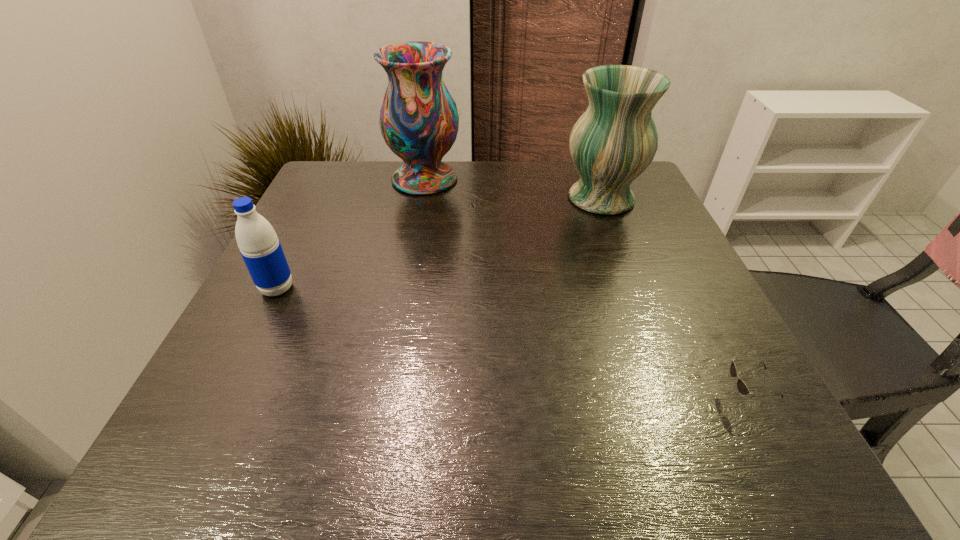
The width and height of the screenshot is (960, 540). I want to click on the left vase, so click(x=419, y=121).

You are a GUI agent. You are given a task and a screenshot of the screen. Output one action in this format:
    pyautogui.click(x=<x>, y=<y>)
    Task: Click on the right vase
    The width and height of the screenshot is (960, 540).
    Given the screenshot: What is the action you would take?
    pyautogui.click(x=613, y=142)

I want to click on water bottle, so click(x=260, y=248).

The height and width of the screenshot is (540, 960). Find the location of `the third farthest object`. the third farthest object is located at coordinates (260, 248).

Locate an element on the screen. the nearest object is located at coordinates (742, 387).

The height and width of the screenshot is (540, 960). Identify the location of sunglasses. (742, 387).

At what (x,y) coordinates should I click in order to perform the action: click on vacant space situated on the left of the left vase. Please return your answer as a coordinate pair (x, y). This screenshot has height=540, width=960. Looking at the image, I should click on (367, 179).

Locate an element on the screen. The height and width of the screenshot is (540, 960). free spot located on the front of the right vase is located at coordinates (640, 302).

The width and height of the screenshot is (960, 540). I want to click on free space located 0.100m on the back of the water bottle, so click(x=298, y=247).

At what (x,y) coordinates should I click in order to perform the action: click on free space located 0.350m in front of the lenses of the nearest object. Please return your answer as a coordinate pair (x, y). This screenshot has height=540, width=960. Looking at the image, I should click on (505, 397).